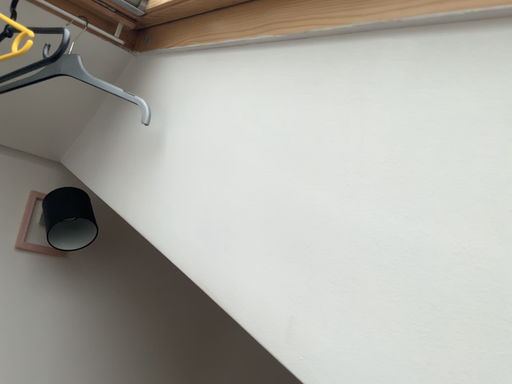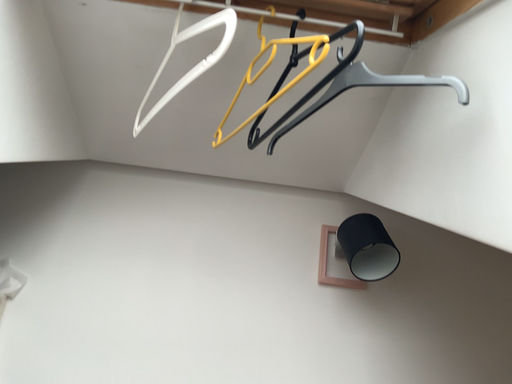
Question: How did the camera likely rotate when shooting the video?

Choices:
 (A) rotated left
 (B) rotated right

Answer: (A)